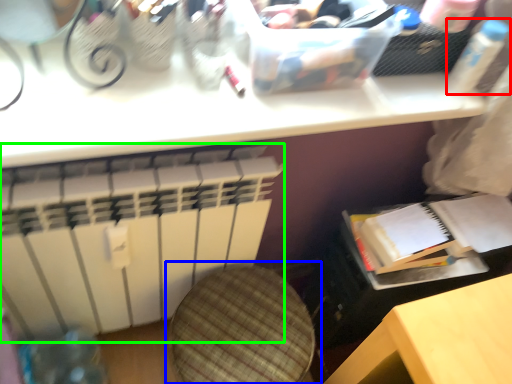
Question: Which object is the closest to the bottle (highlighted by a red box)? Choose among these: swivel chair (highlighted by a blue box) or radiator (highlighted by a green box).

Choices:
 (A) swivel chair
 (B) radiator

Answer: (A)